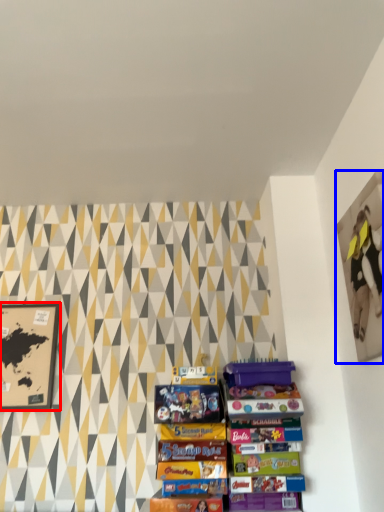
Question: Which point is further to the camera, picture frame (highlighted by a red box) or picture frame (highlighted by a blue box)?

Choices:
 (A) picture frame
 (B) picture frame

Answer: (A)